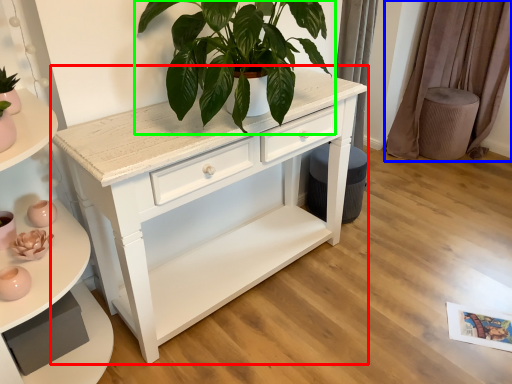
Question: Estimate the real-world distances between objects in this image. Which object is farther from chest of drawers (highlighted by a red box), curtain (highlighted by a blue box) or houseplant (highlighted by a green box)?

Choices:
 (A) curtain
 (B) houseplant

Answer: (A)